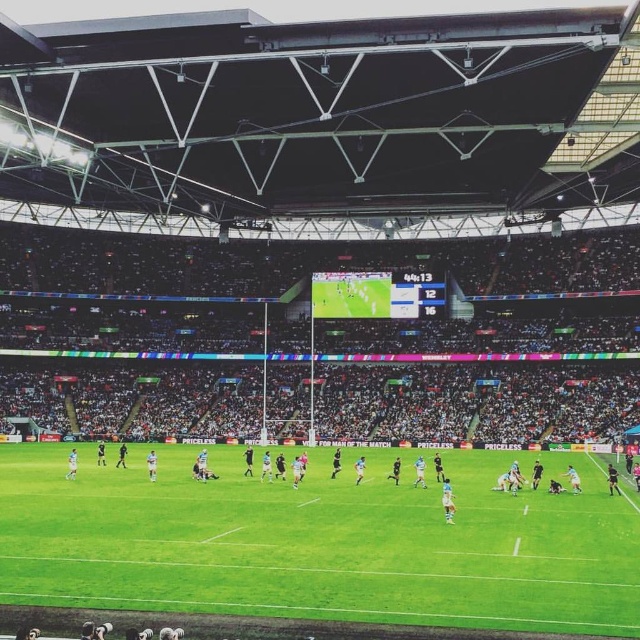
Question: Where is green grass football field at center located in relation to white synthetic grass at center in the image?

Choices:
 (A) above
 (B) below

Answer: (A)

Question: Can you confirm if green grass football field at center is thinner than white synthetic grass at center?

Choices:
 (A) yes
 (B) no

Answer: (A)

Question: Which of the following is the farthest from the observer?

Choices:
 (A) green grass football field at center
 (B) white synthetic grass at center

Answer: (B)

Question: Among these objects, which one is farthest from the camera?

Choices:
 (A) white synthetic grass at center
 (B) green grass football field at center

Answer: (A)

Question: Does green grass football field at center appear on the left side of white synthetic grass at center?

Choices:
 (A) no
 (B) yes

Answer: (A)